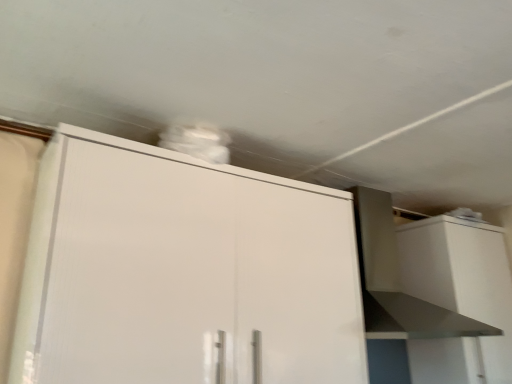
Question: Would you say white glossy cabinet at upper center, which appears as the 1th cabinetry when viewed from the front, contains white matte cabinet at right, the second cabinetry in the left-to-right sequence?

Choices:
 (A) no
 (B) yes

Answer: (A)

Question: Is white glossy cabinet at upper center, marked as the second cabinetry in a back-to-front arrangement, at the left side of white matte cabinet at right, placed as the 1th cabinetry when sorted from back to front?

Choices:
 (A) yes
 (B) no

Answer: (A)

Question: Considering the relative sizes of white glossy cabinet at upper center, positioned as the first cabinetry in left-to-right order, and white matte cabinet at right, which ranks as the first cabinetry in right-to-left order, in the image provided, is white glossy cabinet at upper center, positioned as the first cabinetry in left-to-right order, bigger than white matte cabinet at right, which ranks as the first cabinetry in right-to-left order,?

Choices:
 (A) yes
 (B) no

Answer: (A)

Question: From a real-world perspective, is white glossy cabinet at upper center, marked as the second cabinetry in a back-to-front arrangement, below white matte cabinet at right, placed as the 1th cabinetry when sorted from back to front?

Choices:
 (A) no
 (B) yes

Answer: (A)

Question: Is white glossy cabinet at upper center, positioned as the first cabinetry in left-to-right order, to the right of white matte cabinet at right, the second cabinetry in the left-to-right sequence, from the viewer's perspective?

Choices:
 (A) no
 (B) yes

Answer: (A)

Question: Considering the relative sizes of white glossy cabinet at upper center, positioned as the first cabinetry in left-to-right order, and white matte cabinet at right, which ranks as the first cabinetry in right-to-left order, in the image provided, is white glossy cabinet at upper center, positioned as the first cabinetry in left-to-right order, thinner than white matte cabinet at right, which ranks as the first cabinetry in right-to-left order,?

Choices:
 (A) yes
 (B) no

Answer: (B)

Question: Can you confirm if white matte cabinet at right, placed as the 1th cabinetry when sorted from back to front, is thinner than white glossy cabinet at upper center, arranged as the second cabinetry when viewed from the right?

Choices:
 (A) yes
 (B) no

Answer: (A)

Question: Is the depth of white matte cabinet at right, which is the 2th cabinetry from front to back, less than that of white glossy cabinet at upper center, positioned as the first cabinetry in left-to-right order?

Choices:
 (A) no
 (B) yes

Answer: (A)

Question: Considering the relative sizes of white matte cabinet at right, which ranks as the first cabinetry in right-to-left order, and white glossy cabinet at upper center, arranged as the second cabinetry when viewed from the right, in the image provided, is white matte cabinet at right, which ranks as the first cabinetry in right-to-left order, taller than white glossy cabinet at upper center, arranged as the second cabinetry when viewed from the right,?

Choices:
 (A) no
 (B) yes

Answer: (B)

Question: Is white matte cabinet at right, placed as the 1th cabinetry when sorted from back to front, far away from white glossy cabinet at upper center, which appears as the 1th cabinetry when viewed from the front?

Choices:
 (A) yes
 (B) no

Answer: (B)

Question: Is white matte cabinet at right, placed as the 1th cabinetry when sorted from back to front, looking in the opposite direction of white glossy cabinet at upper center, positioned as the first cabinetry in left-to-right order?

Choices:
 (A) yes
 (B) no

Answer: (B)

Question: From a real-world perspective, does white matte cabinet at right, placed as the 1th cabinetry when sorted from back to front, stand above white glossy cabinet at upper center, arranged as the second cabinetry when viewed from the right?

Choices:
 (A) no
 (B) yes

Answer: (A)

Question: Does white matte vent at upper right lie in front of white matte cabinet at right, which ranks as the first cabinetry in right-to-left order?

Choices:
 (A) yes
 (B) no

Answer: (A)